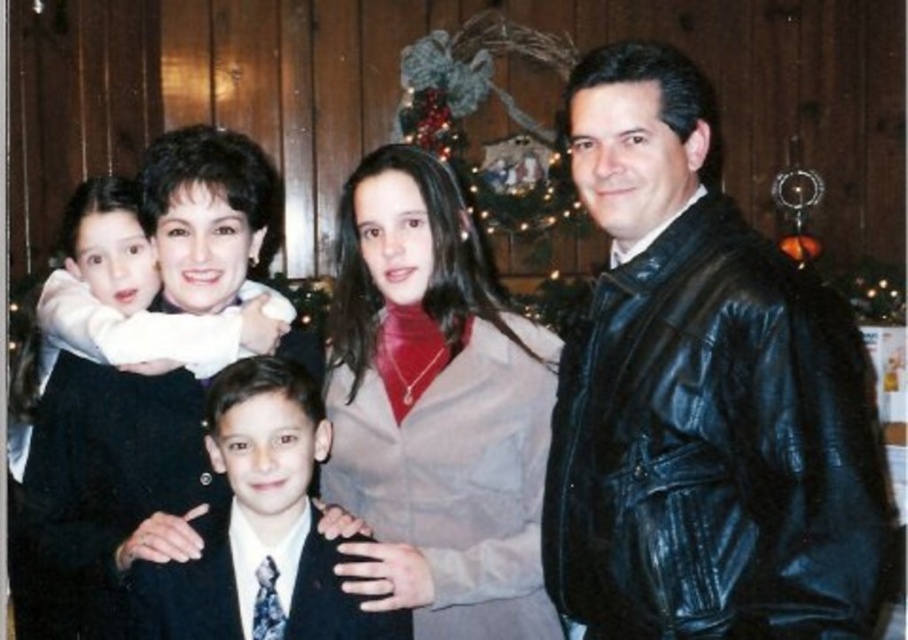
Question: Based on their relative distances, which object is farther from the dark blue suit at center?

Choices:
 (A) matte black suit at left
 (B) black leather jacket at right

Answer: (B)

Question: Is black leather jacket at right smaller than dark blue suit at center?

Choices:
 (A) yes
 (B) no

Answer: (B)

Question: Among these points, which one is nearest to the camera?

Choices:
 (A) (653, 528)
 (B) (346, 612)

Answer: (A)

Question: Estimate the real-world distances between objects in this image. Which object is farther from the dark blue suit at center?

Choices:
 (A) black leather jacket at right
 (B) matte black suit at left

Answer: (A)

Question: In this image, where is matte black suit at left located relative to dark blue suit at center?

Choices:
 (A) below
 (B) above

Answer: (B)

Question: Observing the image, what is the correct spatial positioning of black leather jacket at right in reference to dark blue suit at center?

Choices:
 (A) below
 (B) above

Answer: (B)